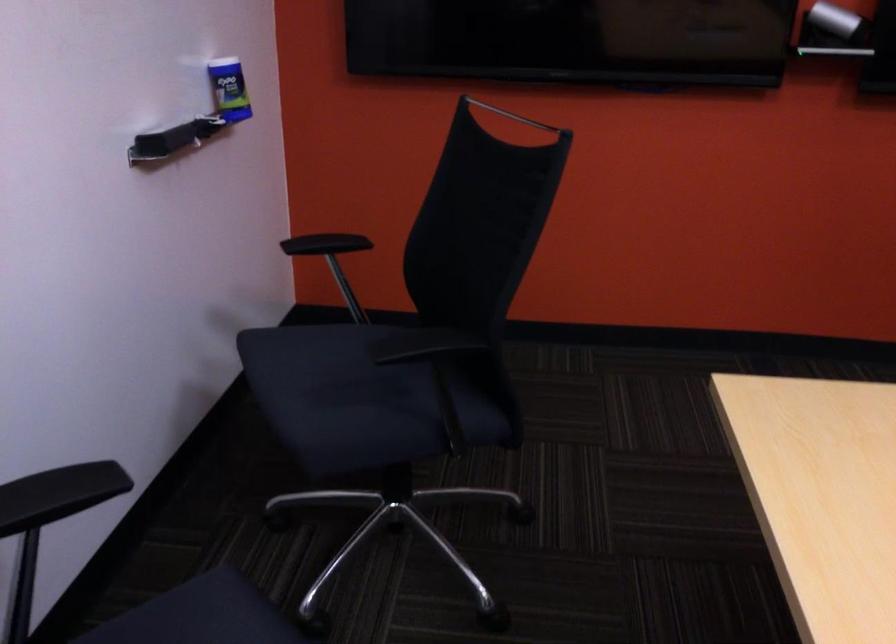
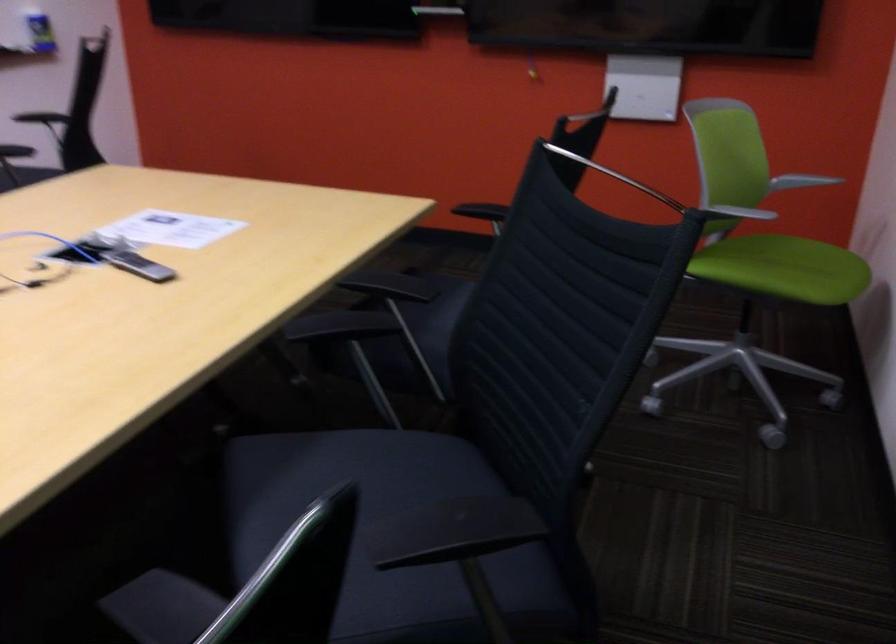
Which direction would the cameraman need to move to produce the second image?

The cameraman walked toward right, backward.